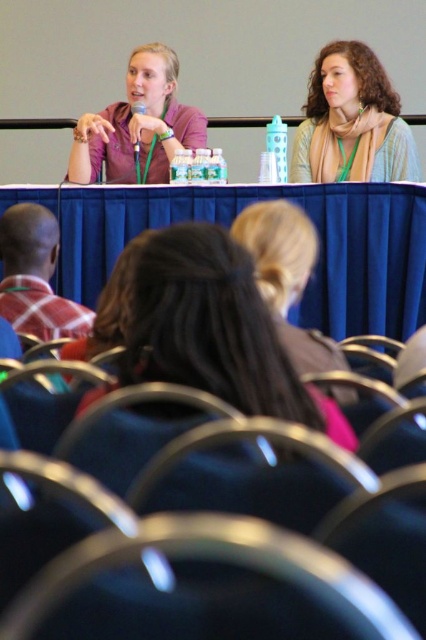
Can you confirm if blue fabric table at center is smaller than blonde hair at center?

Incorrect, blue fabric table at center is not smaller in size than blonde hair at center.

Which is more to the right, blue fabric table at center or blonde hair at center?

blonde hair at center is more to the right.

The image size is (426, 640). In order to click on blue fabric table at center in this screenshot , I will do `click(230, 225)`.

Image resolution: width=426 pixels, height=640 pixels. Identify the location of blue fabric table at center. (230, 225).

Which is in front, point (319, 259) or point (141, 99)?

Positioned in front is point (319, 259).

The width and height of the screenshot is (426, 640). What do you see at coordinates (230, 225) in the screenshot? I see `blue fabric table at center` at bounding box center [230, 225].

Identify the location of blue fabric table at center. click(x=230, y=225).

Which is below, blonde hair at center or matte purple shirt at upper left?

blonde hair at center is lower down.

What do you see at coordinates (206, 326) in the screenshot?
I see `blonde hair at center` at bounding box center [206, 326].

Between point (258, 404) and point (134, 93), which one is positioned behind?

Positioned behind is point (134, 93).

Locate an element on the screen. This screenshot has height=640, width=426. blonde hair at center is located at coordinates (206, 326).